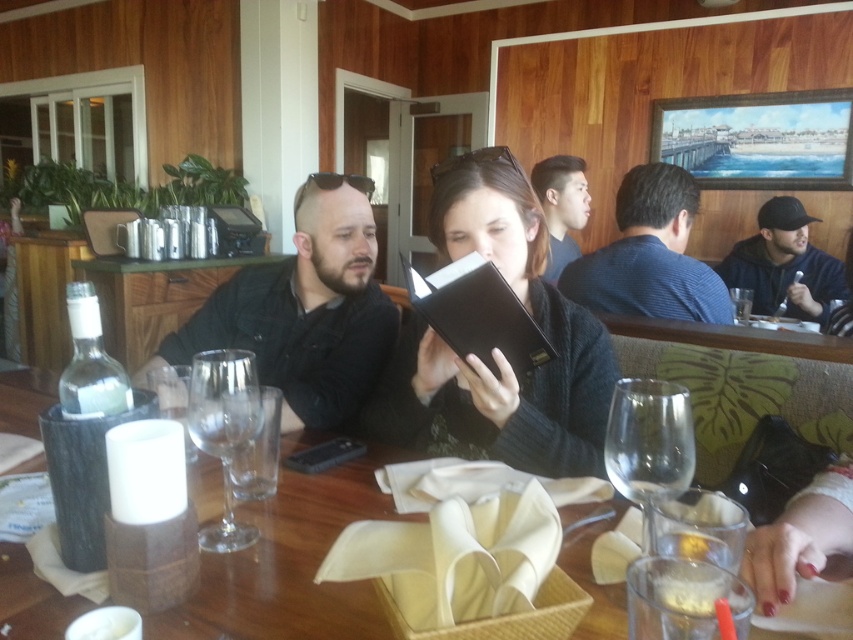
You are a photographer positioned at the entrance of the dining area. You want to take a photo that includes both the dark blue hoodie at right and the smooth black hair at upper center. Which object should you focus on first to ensure both are in clear view?

You should focus on the dark blue hoodie at right first because it is closer to you than the smooth black hair at upper center, ensuring both will be in focus when prioritizing the nearer object.

You are a photographer trying to capture a candid shot of both the dark blue hoodie at right and the smooth black hair at upper center in the same frame. Based on their positions and sizes, do you think you can fit both subjects into your camera viewfinder without cropping either of them?

The dark blue hoodie at right might be wider than smooth black hair at upper center, so it is possible to fit both into the camera viewfinder as long as the viewfinder can accommodate the width of the wider object.

You are a server at the restaurant and need to place a new dessert plate on the table. The dessert plate is 25 cm in diameter. Can you fit it on the wooden table at center without overlapping the transparent glass wine glass at table center?

The wooden table at center might be wider than transparent glass wine glass at table center, so it is possible that the dessert plate can fit. However, without exact measurements of the table and the distance between the objects, we cannot be certain.